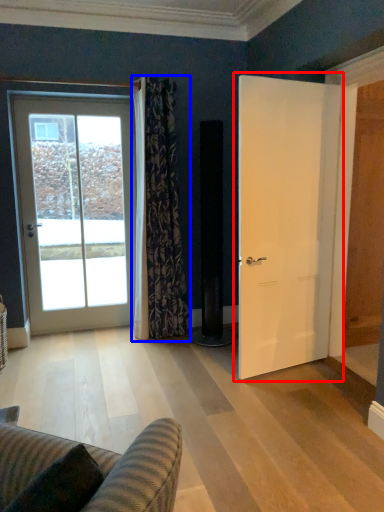
Question: Among these objects, which one is nearest to the camera, door (highlighted by a red box) or curtain (highlighted by a blue box)?

Choices:
 (A) door
 (B) curtain

Answer: (A)